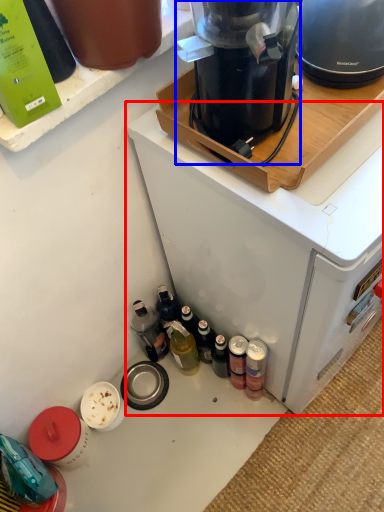
Question: Which point is further to the camera, home appliance (highlighted by a red box) or kitchen appliance (highlighted by a blue box)?

Choices:
 (A) home appliance
 (B) kitchen appliance

Answer: (A)